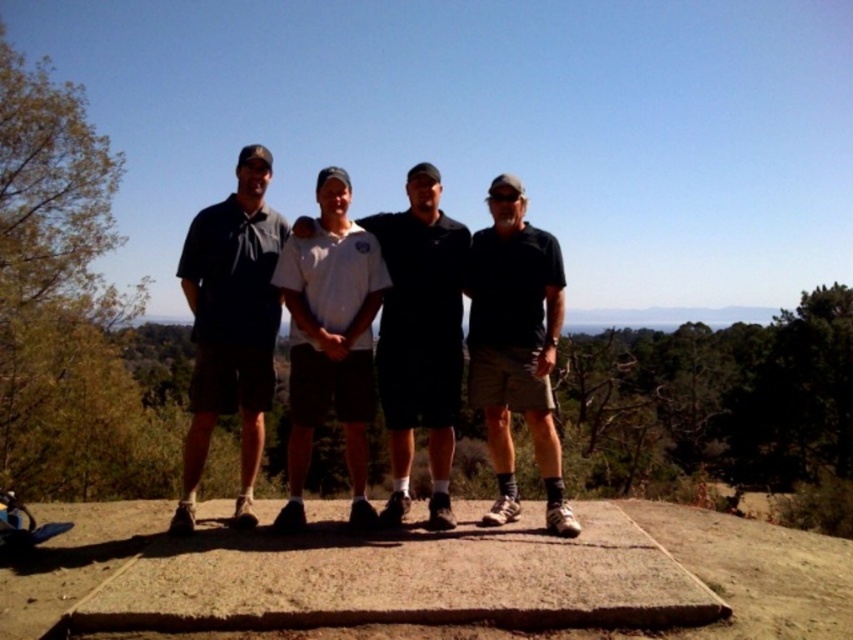
Does dark gray fabric shirt at left have a greater height compared to white cotton shirt at center?

No.

Is point (250, 420) positioned behind point (422, 164)?

No, (250, 420) is in front of (422, 164).

This screenshot has width=853, height=640. In order to click on dark gray fabric shirt at left in this screenshot , I will do `click(230, 326)`.

At what (x,y) coordinates should I click in order to perform the action: click on dark gray fabric shirt at left. Please return your answer as a coordinate pair (x, y). Image resolution: width=853 pixels, height=640 pixels. Looking at the image, I should click on (230, 326).

Is point (184, 275) positioned after point (537, 360)?

Yes, point (184, 275) is behind point (537, 360).

Is dark gray fabric shirt at left positioned at the back of black cotton shirt at right?

Yes, it is behind black cotton shirt at right.

Describe the element at coordinates (230, 326) in the screenshot. This screenshot has width=853, height=640. I see `dark gray fabric shirt at left` at that location.

This screenshot has height=640, width=853. I want to click on dark gray fabric shirt at left, so click(x=230, y=326).

Can you confirm if white cotton shirt at center is shorter than black cotton shirt at right?

No.

Find the location of a particular element. white cotton shirt at center is located at coordinates (421, 339).

The width and height of the screenshot is (853, 640). Find the location of `white cotton shirt at center`. white cotton shirt at center is located at coordinates (421, 339).